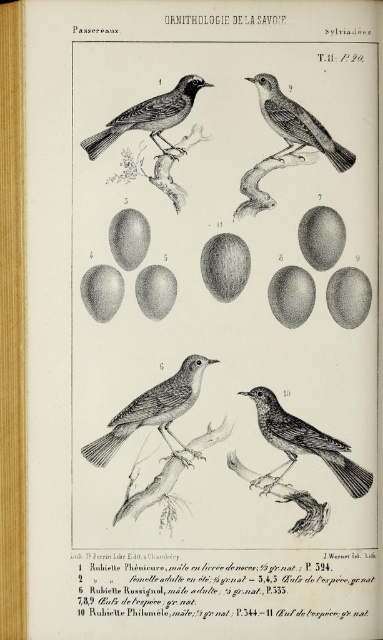
Question: Does smooth black bird at center appear over black textured bird at upper left?

Choices:
 (A) no
 (B) yes

Answer: (A)

Question: Can you confirm if smooth black bird at center is smaller than smooth gray bird at upper center?

Choices:
 (A) yes
 (B) no

Answer: (B)

Question: Estimate the real-world distances between objects in this image. Which object is closer to the smooth black bird at center?

Choices:
 (A) grayish-brown bird at center
 (B) black textured bird at upper left
 (C) smooth gray bird at upper center

Answer: (A)

Question: Which of the following is the farthest from the observer?

Choices:
 (A) [112, 134]
 (B) [126, 433]
 (C) [289, 442]
 (D) [306, 125]

Answer: (C)

Question: From the image, what is the correct spatial relationship of black textured bird at upper left in relation to smooth gray bird at upper center?

Choices:
 (A) right
 (B) left

Answer: (B)

Question: Which point is closer to the camera taking this photo?

Choices:
 (A) (291, 461)
 (B) (109, 122)
 (C) (139, 403)
 (D) (322, 148)

Answer: (B)